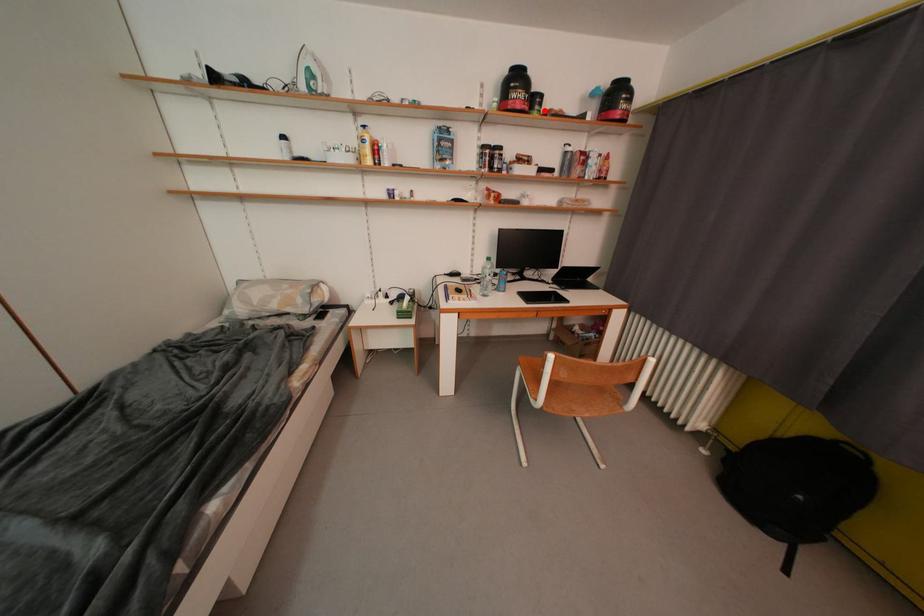
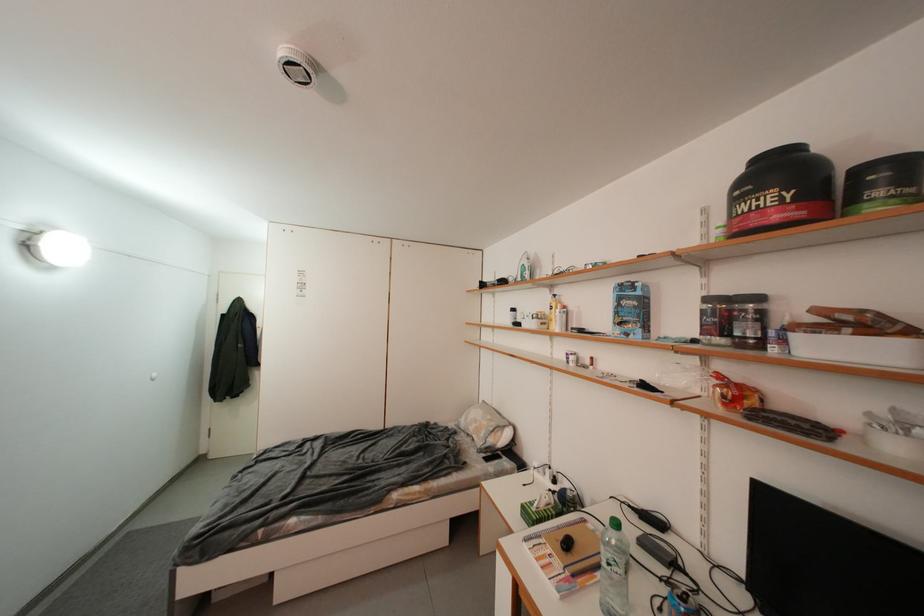
Question: I am providing you with two images of the same scene from different viewpoints. Given a red point in image1, look at the same physical point in image2. Is it:

Choices:
 (A) Closer to the viewpoint
 (B) Farther from the viewpoint

Answer: (B)